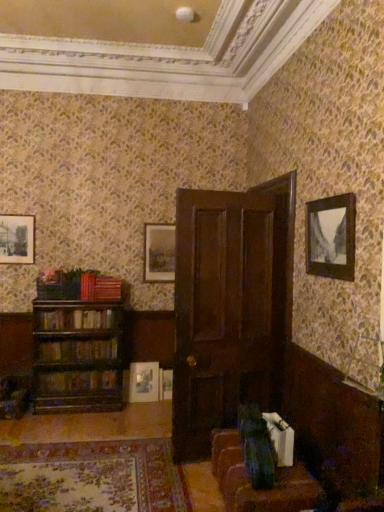
Question: Which direction should I rotate to look at matte wooden picture frame at center, which is the first picture frame in back-to-front order?

Choices:
 (A) right
 (B) left

Answer: (B)

Question: Considering the relative sizes of dark wood door at center and velvet green swivel chair at lower center in the image provided, is dark wood door at center shorter than velvet green swivel chair at lower center?

Choices:
 (A) yes
 (B) no

Answer: (B)

Question: Is dark wood door at center not inside velvet green swivel chair at lower center?

Choices:
 (A) no
 (B) yes

Answer: (B)

Question: Could you tell me if dark wood door at center is turned towards velvet green swivel chair at lower center?

Choices:
 (A) no
 (B) yes

Answer: (B)

Question: From the image's perspective, is dark wood door at center above velvet green swivel chair at lower center?

Choices:
 (A) no
 (B) yes

Answer: (B)

Question: Does dark wood door at center touch velvet green swivel chair at lower center?

Choices:
 (A) no
 (B) yes

Answer: (A)

Question: From a real-world perspective, is dark wood door at center beneath velvet green swivel chair at lower center?

Choices:
 (A) yes
 (B) no

Answer: (B)

Question: Is red matte book at left, the 1th book positioned from the top, bigger than matte wooden picture frame at center, the second picture frame positioned from the bottom?

Choices:
 (A) yes
 (B) no

Answer: (B)

Question: Does red matte book at left, marked as the fourth book in a bottom-to-top arrangement, have a greater height compared to matte wooden picture frame at center, the 3th picture frame in the left-to-right sequence?

Choices:
 (A) yes
 (B) no

Answer: (B)

Question: Is red matte book at left, marked as the fourth book in a bottom-to-top arrangement, shorter than matte wooden picture frame at center, the second picture frame positioned from the bottom?

Choices:
 (A) yes
 (B) no

Answer: (A)

Question: Is red matte book at left, marked as the fourth book in a bottom-to-top arrangement, wider than matte wooden picture frame at center, placed as the 2th picture frame when sorted from right to left?

Choices:
 (A) no
 (B) yes

Answer: (B)

Question: Is red matte book at left, marked as the fourth book in a bottom-to-top arrangement, smaller than matte wooden picture frame at center, which is the fourth picture frame from front to back?

Choices:
 (A) no
 (B) yes

Answer: (B)

Question: Could you tell me if red matte book at left, the 1th book positioned from the top, is turned towards matte wooden picture frame at center, placed as the 2th picture frame when sorted from right to left?

Choices:
 (A) no
 (B) yes

Answer: (A)

Question: From the image's perspective, is velvet brown couch at lower right over wooden book at left, arranged as the 1th book when ordered from the bottom?

Choices:
 (A) yes
 (B) no

Answer: (B)